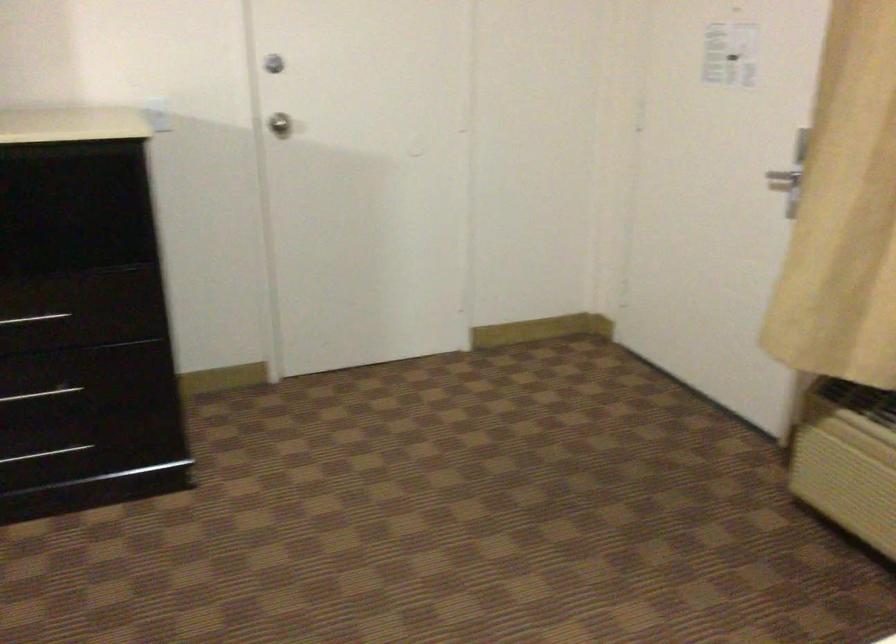
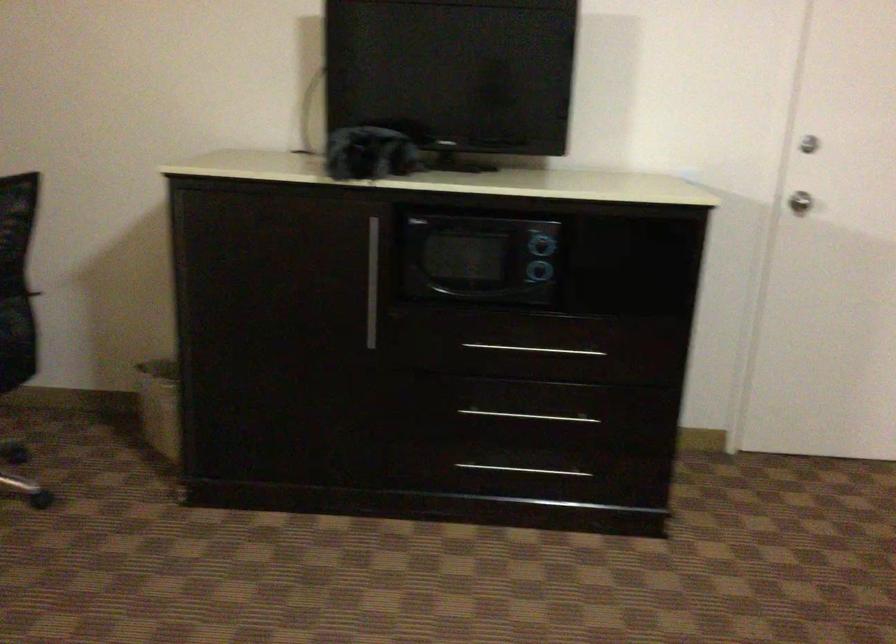
The point at [286,120] is marked in the first image. Where is the corresponding point in the second image?

(803, 180)